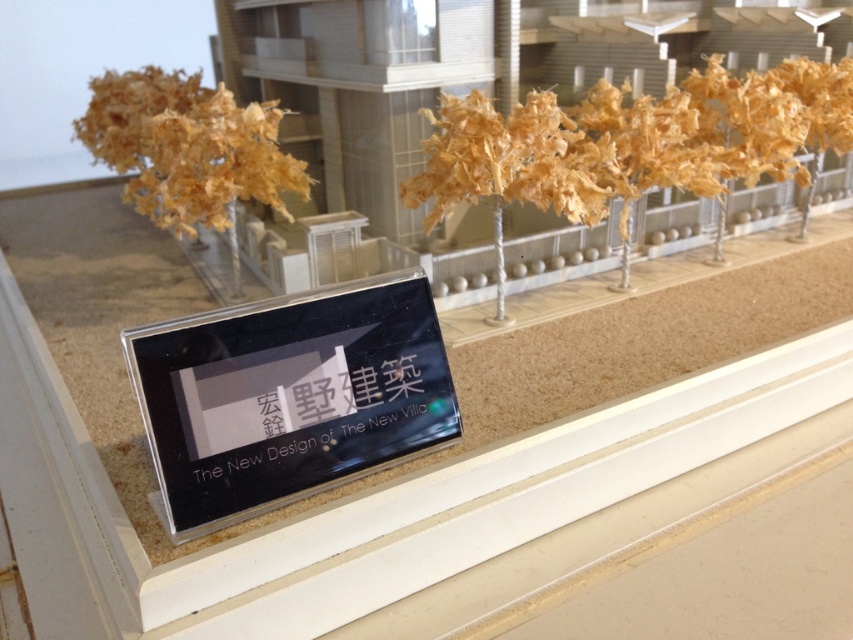
Question: Among these points, which one is nearest to the camera?

Choices:
 (A) (819, 68)
 (B) (276, 150)
 (C) (151, 330)
 (D) (486, 417)

Answer: (C)

Question: From the image, what is the correct spatial relationship of black acrylic sign at center in relation to dry wood at left?

Choices:
 (A) left
 (B) right

Answer: (B)

Question: Where is black acrylic sign at center located in relation to light brown papier-mâché trees at upper center in the image?

Choices:
 (A) left
 (B) right

Answer: (A)

Question: Which is farther from the dry wood at left?

Choices:
 (A) beige cork board at center
 (B) black acrylic sign at center
 (C) light brown papier-mâché trees at upper center

Answer: (B)

Question: In this image, where is black acrylic sign at center located relative to light brown papier-mâché trees at upper center?

Choices:
 (A) right
 (B) left

Answer: (B)

Question: Which is nearer to the black acrylic sign at center?

Choices:
 (A) beige cork board at center
 (B) light brown papier-mâché trees at upper center
 (C) dry wood at left

Answer: (A)